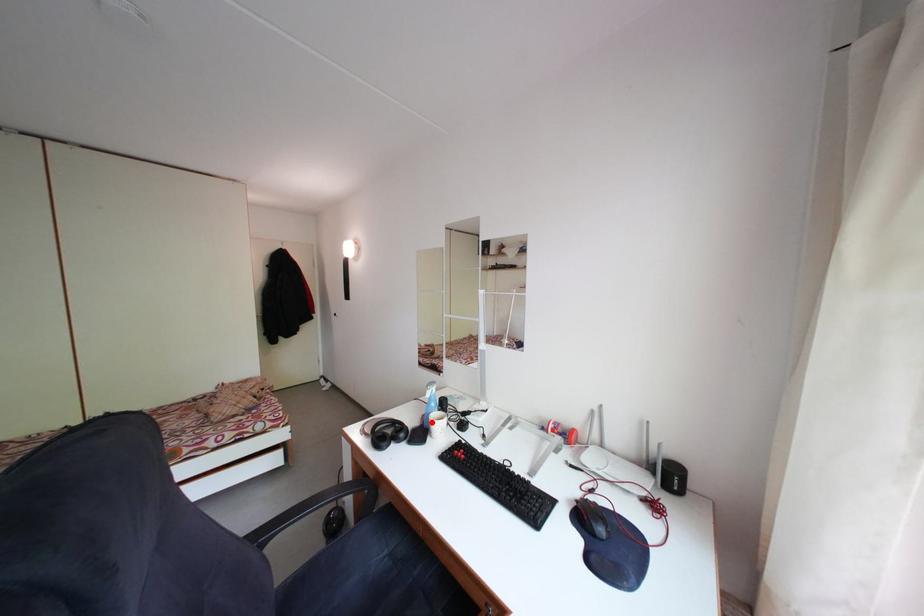
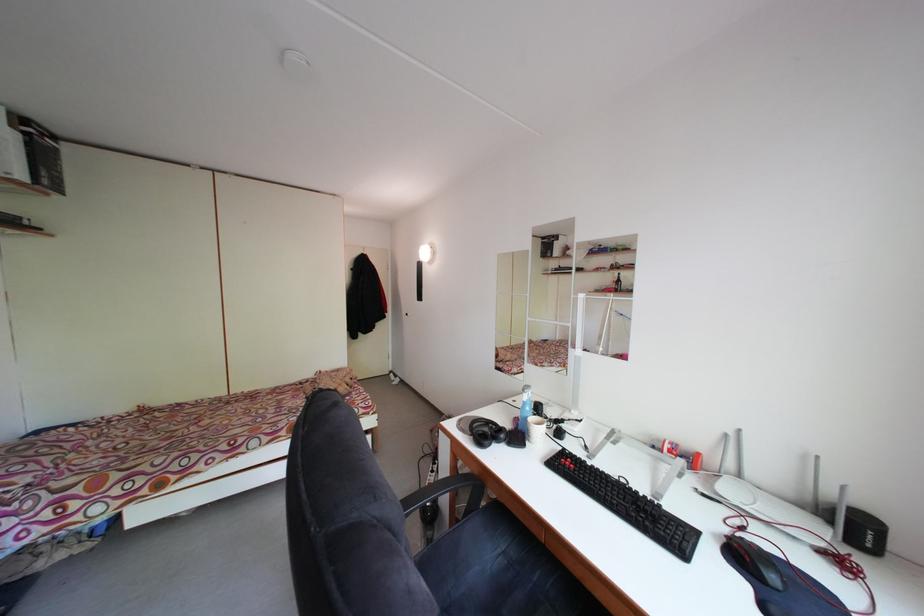
Question: I am providing you with two images of the same scene from different viewpoints. In image1, a red point is highlighted. Considering the same 3D point in image2, which of the following is correct?

Choices:
 (A) It is closer
 (B) It is farther

Answer: (A)